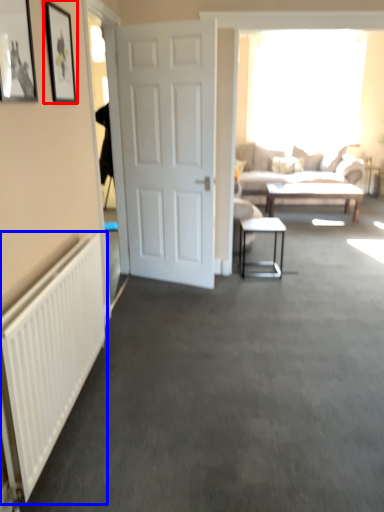
Question: Which object is closer to the camera taking this photo, picture frame (highlighted by a red box) or radiator (highlighted by a blue box)?

Choices:
 (A) picture frame
 (B) radiator

Answer: (B)